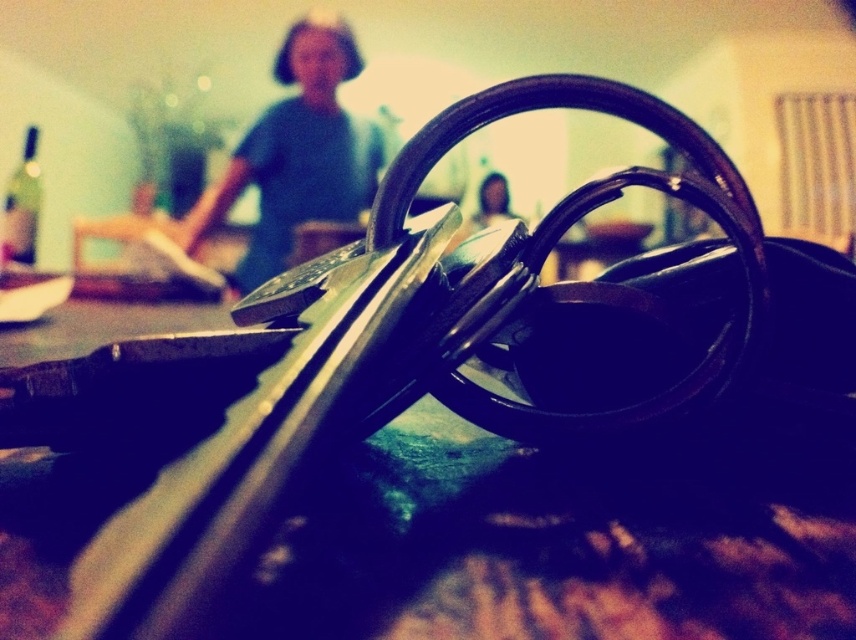
Does metallic black keys at center have a larger size compared to smooth skin face at center?

Yes.

Does point (437, 484) come behind point (488, 212)?

That is False.

Between point (76, 512) and point (480, 208), which one is positioned behind?

Point (480, 208)

Find the location of a particular element. This screenshot has width=856, height=640. metallic black keys at center is located at coordinates (563, 540).

Does blue fabric shirt at upper center have a smaller size compared to smooth skin face at center?

No, blue fabric shirt at upper center is not smaller than smooth skin face at center.

Between point (296, 29) and point (501, 205), which one is positioned in front?

Point (501, 205) is more forward.

Which is in front, point (373, 186) or point (489, 193)?

Point (489, 193) is more forward.

Image resolution: width=856 pixels, height=640 pixels. In order to click on blue fabric shirt at upper center in this screenshot , I will do `click(296, 154)`.

Consider the image. Can you confirm if metallic black keys at center is positioned above blue fabric shirt at upper center?

No.

Between metallic black keys at center and blue fabric shirt at upper center, which one appears on the left side from the viewer's perspective?

blue fabric shirt at upper center is more to the left.

Which is in front, point (51, 593) or point (330, 180)?

Positioned in front is point (51, 593).

At what (x,y) coordinates should I click in order to perform the action: click on metallic black keys at center. Please return your answer as a coordinate pair (x, y). This screenshot has width=856, height=640. Looking at the image, I should click on (563, 540).